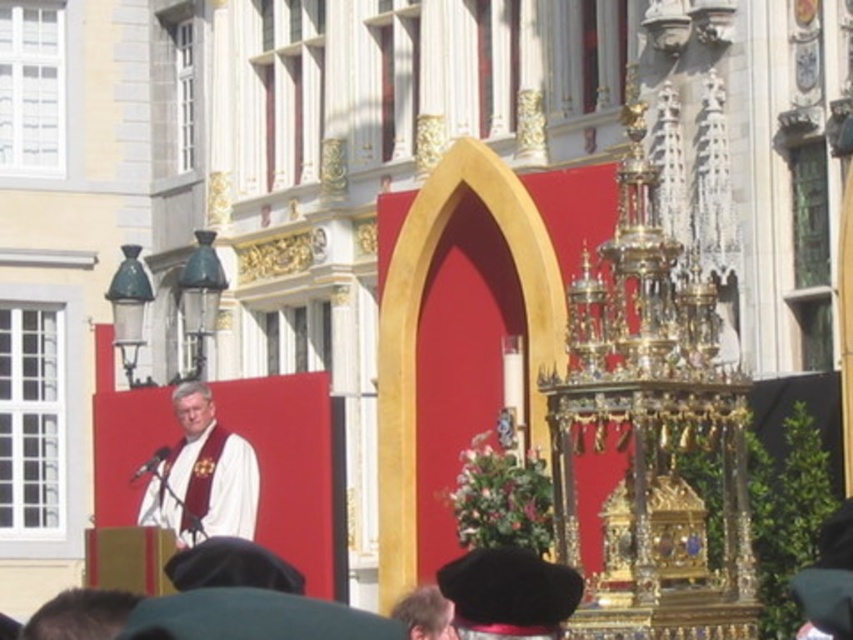
Question: Which of the following is the closest to the observer?

Choices:
 (A) (247, 497)
 (B) (490, 605)

Answer: (B)

Question: Which of the following is the farthest from the observer?

Choices:
 (A) black felt hat at lower center
 (B) white cloth at center

Answer: (B)

Question: Observing the image, what is the correct spatial positioning of white cloth at center in reference to black felt hat at lower center?

Choices:
 (A) left
 (B) right

Answer: (A)

Question: Is white cloth at center below black felt hat at lower center?

Choices:
 (A) no
 (B) yes

Answer: (A)

Question: Does white cloth at center appear on the left side of black felt hat at lower center?

Choices:
 (A) no
 (B) yes

Answer: (B)

Question: Which object appears closest to the camera in this image?

Choices:
 (A) white cloth at center
 (B) black felt hat at lower center

Answer: (B)